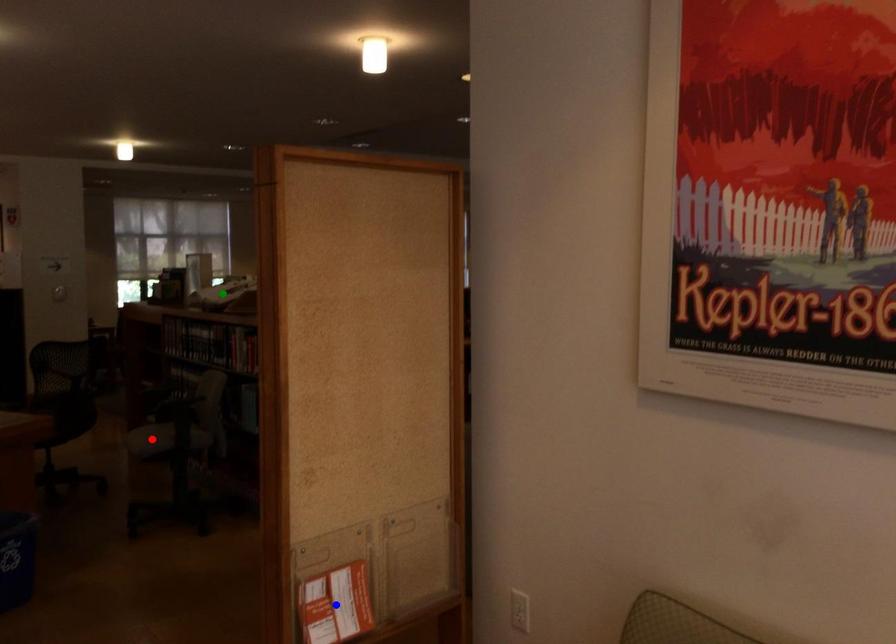
From the picture: Order these from nearest to farthest:
1. green point
2. red point
3. blue point

blue point → red point → green point